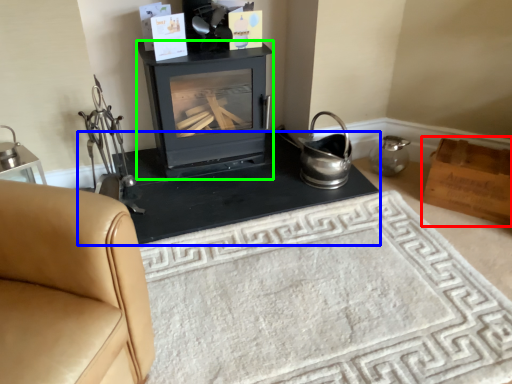
Question: Considering the real-world distances, which object is farthest from box (highlighted by a red box)? table (highlighted by a blue box) or wood burning stove (highlighted by a green box)?

Choices:
 (A) table
 (B) wood burning stove

Answer: (B)